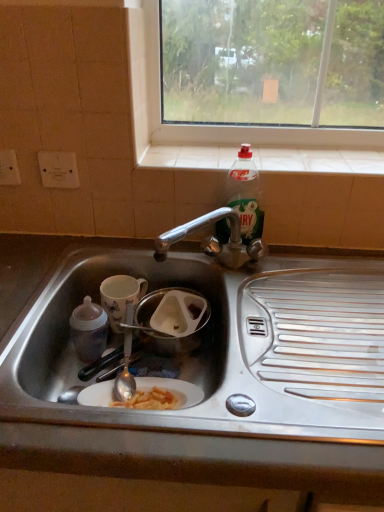
Question: Does porcelain floral mug at sink, the 2th coffee cup when ordered from front to back, have a lesser height compared to stainless steel sink at lower left?

Choices:
 (A) yes
 (B) no

Answer: (A)

Question: Is porcelain floral mug at sink, the 2th coffee cup when ordered from front to back, looking in the opposite direction of stainless steel sink at lower left?

Choices:
 (A) yes
 (B) no

Answer: (A)

Question: Does porcelain floral mug at sink, the 2th coffee cup when ordered from front to back, lie in front of stainless steel sink at lower left?

Choices:
 (A) no
 (B) yes

Answer: (A)

Question: Is porcelain floral mug at sink, which ranks as the first coffee cup in back-to-front order, bigger than stainless steel sink at lower left?

Choices:
 (A) yes
 (B) no

Answer: (B)

Question: Is porcelain floral mug at sink, the 2th coffee cup when ordered from front to back, to the left of stainless steel sink at lower left from the viewer's perspective?

Choices:
 (A) yes
 (B) no

Answer: (B)

Question: Can you confirm if porcelain floral mug at sink, the 2th coffee cup when ordered from front to back, is taller than stainless steel sink at lower left?

Choices:
 (A) yes
 (B) no

Answer: (B)

Question: Is stainless steel sink at lower left facing away from translucent plastic bottle at upper right?

Choices:
 (A) yes
 (B) no

Answer: (B)

Question: Is stainless steel sink at lower left in contact with translucent plastic bottle at upper right?

Choices:
 (A) yes
 (B) no

Answer: (B)

Question: Is stainless steel sink at lower left not close to translucent plastic bottle at upper right?

Choices:
 (A) no
 (B) yes

Answer: (A)

Question: From a real-world perspective, is stainless steel sink at lower left located higher than translucent plastic bottle at upper right?

Choices:
 (A) yes
 (B) no

Answer: (B)

Question: Is stainless steel sink at lower left smaller than translucent plastic bottle at upper right?

Choices:
 (A) yes
 (B) no

Answer: (B)

Question: Does stainless steel sink at lower left lie behind translucent plastic bottle at upper right?

Choices:
 (A) yes
 (B) no

Answer: (B)

Question: Is porcelain floral mug at sink, which ranks as the first coffee cup in back-to-front order, wider than matte ceramic coffee cup at left, which is the 1th coffee cup from front to back?

Choices:
 (A) yes
 (B) no

Answer: (A)